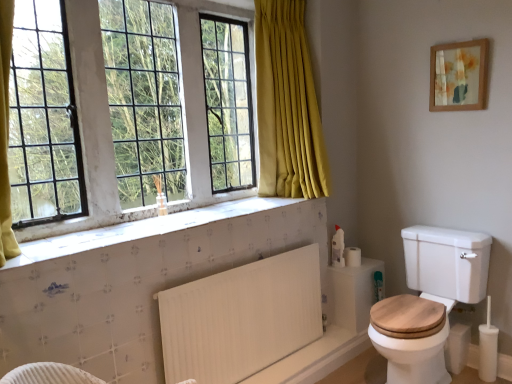
Question: Is white glass window at upper left positioned beyond the bounds of white matte toilet paper at right?

Choices:
 (A) yes
 (B) no

Answer: (A)

Question: Can you confirm if white glass window at upper left is smaller than white matte toilet paper at right?

Choices:
 (A) no
 (B) yes

Answer: (A)

Question: From the image's perspective, would you say white glass window at upper left is positioned over white matte toilet paper at right?

Choices:
 (A) yes
 (B) no

Answer: (A)

Question: Is there a large distance between white glass window at upper left and white matte toilet paper at right?

Choices:
 (A) yes
 (B) no

Answer: (A)

Question: From a real-world perspective, is white glass window at upper left on white matte toilet paper at right?

Choices:
 (A) no
 (B) yes

Answer: (B)

Question: Is white glass window at upper left taller than white matte toilet paper at right?

Choices:
 (A) yes
 (B) no

Answer: (A)

Question: Considering the relative sizes of white glass window at upper left and wooden framed artwork at upper right in the image provided, is white glass window at upper left wider than wooden framed artwork at upper right?

Choices:
 (A) yes
 (B) no

Answer: (A)

Question: From the image's perspective, is white glass window at upper left located above wooden framed artwork at upper right?

Choices:
 (A) yes
 (B) no

Answer: (B)

Question: Can you confirm if white glass window at upper left is thinner than wooden framed artwork at upper right?

Choices:
 (A) no
 (B) yes

Answer: (A)

Question: Considering the relative positions of white glass window at upper left and wooden framed artwork at upper right in the image provided, is white glass window at upper left behind wooden framed artwork at upper right?

Choices:
 (A) no
 (B) yes

Answer: (A)

Question: From a real-world perspective, is white glass window at upper left located higher than wooden framed artwork at upper right?

Choices:
 (A) yes
 (B) no

Answer: (B)

Question: Is white glass window at upper left in front of wooden framed artwork at upper right?

Choices:
 (A) yes
 (B) no

Answer: (A)

Question: Would you say wooden framed artwork at upper right is part of white matte toilet paper at right's contents?

Choices:
 (A) yes
 (B) no

Answer: (B)